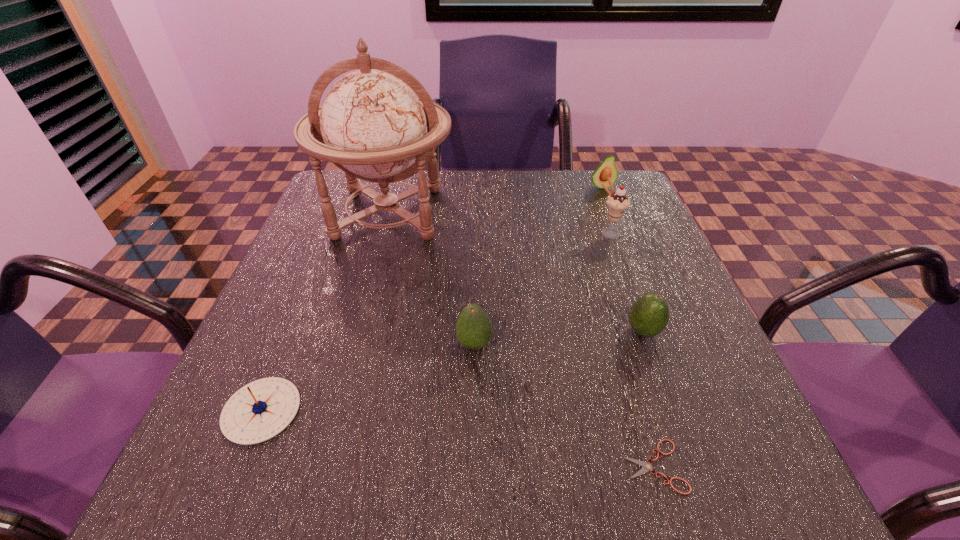
Locate which object ranks fifth in proximity to the leftmost avocado. Please provide its 2D coordinates. Your answer should be formatted as a tuple, i.e. [(x, y)], where the tuple contains the x and y coordinates of a point satisfying the conditions above.

[(617, 202)]

Select which object appears as the second closest to the tallest object. Please provide its 2D coordinates. Your answer should be formatted as a tuple, i.e. [(x, y)], where the tuple contains the x and y coordinates of a point satisfying the conditions above.

[(260, 410)]

Where is `avocado that stands as the second closest to the shears`? avocado that stands as the second closest to the shears is located at coordinates (474, 328).

Locate which avocado is the third closest to the tallest object. Please provide its 2D coordinates. Your answer should be formatted as a tuple, i.e. [(x, y)], where the tuple contains the x and y coordinates of a point satisfying the conditions above.

[(649, 315)]

At what (x,y) coordinates should I click in order to perform the action: click on free space that satisfies the following two spatial constraints: 1. on the front-facing side of the tallest object; 2. on the right side of the icecream. Please return your answer as a coordinate pair (x, y). This screenshot has width=960, height=540. Looking at the image, I should click on (383, 234).

Where is `vacant region that satisfies the following two spatial constraints: 1. on the front-facing side of the tallest object; 2. on the left side of the icecream`? This screenshot has width=960, height=540. vacant region that satisfies the following two spatial constraints: 1. on the front-facing side of the tallest object; 2. on the left side of the icecream is located at coordinates (383, 234).

The height and width of the screenshot is (540, 960). In order to click on free location that satisfies the following two spatial constraints: 1. on the front-facing side of the tallest object; 2. on the right side of the sixth shortest object in this screenshot , I will do 383,234.